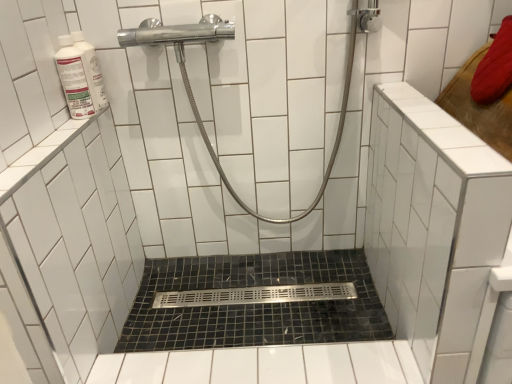
What is the approximate height of black mosaic tile bath at center?

It is 7.89 centimeters.

I want to click on polished chrome showerhead at upper center, so click(230, 38).

How different are the orientations of black mosaic tile bath at center and polished chrome showerhead at upper center in degrees?

There is a 0.8-degree angle between the facing directions of black mosaic tile bath at center and polished chrome showerhead at upper center.

Is black mosaic tile bath at center spatially inside polished chrome showerhead at upper center, or outside of it?

black mosaic tile bath at center is outside polished chrome showerhead at upper center.

Between black mosaic tile bath at center and polished chrome showerhead at upper center, which one has smaller width?

polished chrome showerhead at upper center is thinner.

Where is `shower positioned vertically above the black mosaic tile bath at center (from a real-world perspective)`? The height and width of the screenshot is (384, 512). shower positioned vertically above the black mosaic tile bath at center (from a real-world perspective) is located at coordinates (230, 38).

Locate an element on the screen. shower that is in front of the white glossy bottle at upper left is located at coordinates (230, 38).

Is polished chrome showerhead at upper center spatially inside white glossy bottle at upper left, or outside of it?

polished chrome showerhead at upper center is not enclosed by white glossy bottle at upper left.

Can you confirm if polished chrome showerhead at upper center is positioned to the left of white glossy bottle at upper left?

Incorrect, polished chrome showerhead at upper center is not on the left side of white glossy bottle at upper left.

Who is bigger, polished chrome showerhead at upper center or white glossy bottle at upper left?

With larger size is polished chrome showerhead at upper center.

Are polished chrome showerhead at upper center and black mosaic tile bath at center located far from each other?

polished chrome showerhead at upper center is actually quite close to black mosaic tile bath at center.

Is polished chrome showerhead at upper center oriented away from black mosaic tile bath at center?

polished chrome showerhead at upper center is not turned away from black mosaic tile bath at center.

Is polished chrome showerhead at upper center positioned beyond the bounds of black mosaic tile bath at center?

polished chrome showerhead at upper center is positioned outside black mosaic tile bath at center.

In terms of height, does white glossy bottle at upper left look taller or shorter compared to black mosaic tile bath at center?

white glossy bottle at upper left is taller than black mosaic tile bath at center.

From the image's perspective, is white glossy bottle at upper left on black mosaic tile bath at center?

Yes, from the image's perspective, white glossy bottle at upper left is on top of black mosaic tile bath at center.

Identify the location of toiletry above the black mosaic tile bath at center (from a real-world perspective). (75, 79).

Which of these two, white glossy bottle at upper left or black mosaic tile bath at center, is thinner?

white glossy bottle at upper left is thinner.

From a real-world perspective, is black mosaic tile bath at center positioned above or below white glossy bottle at upper left?

In terms of real-world spatial position, black mosaic tile bath at center is below white glossy bottle at upper left.

Does point (145, 293) lie behind point (84, 82)?

Yes, point (145, 293) is farther from viewer.

There is a black mosaic tile bath at center. At what (x,y) coordinates should I click in order to perform the action: click on toiletry above it (from a real-world perspective). Please return your answer as a coordinate pair (x, y). Image resolution: width=512 pixels, height=384 pixels. Looking at the image, I should click on (75, 79).

Is black mosaic tile bath at center thinner than white glossy bottle at upper left?

No, black mosaic tile bath at center is not thinner than white glossy bottle at upper left.

Which is behind, point (83, 97) or point (180, 52)?

The point (180, 52) is more distant.

Is white glossy bottle at upper left to the left of polished chrome showerhead at upper center from the viewer's perspective?

Indeed, white glossy bottle at upper left is positioned on the left side of polished chrome showerhead at upper center.

Could you tell me if white glossy bottle at upper left is facing polished chrome showerhead at upper center?

Yes, white glossy bottle at upper left faces towards polished chrome showerhead at upper center.

I want to click on bath below the polished chrome showerhead at upper center (from the image's perspective), so click(x=253, y=304).

Locate an element on the screen. toiletry lying above the polished chrome showerhead at upper center (from the image's perspective) is located at coordinates (75, 79).

Estimate the real-world distances between objects in this image. Which object is closer to polished chrome showerhead at upper center, white glossy bottle at upper left or black mosaic tile bath at center?

The object closer to polished chrome showerhead at upper center is white glossy bottle at upper left.

Considering their positions, is black mosaic tile bath at center positioned closer to polished chrome showerhead at upper center than white glossy bottle at upper left?

Based on the image, white glossy bottle at upper left appears to be nearer to polished chrome showerhead at upper center.

Looking at the image, which one is located closer to white glossy bottle at upper left, polished chrome showerhead at upper center or black mosaic tile bath at center?

polished chrome showerhead at upper center is closer to white glossy bottle at upper left.

Looking at the image, which one is located closer to white glossy bottle at upper left, black mosaic tile bath at center or polished chrome showerhead at upper center?

Based on the image, polished chrome showerhead at upper center appears to be nearer to white glossy bottle at upper left.

Looking at the image, which one is located further to black mosaic tile bath at center, white glossy bottle at upper left or polished chrome showerhead at upper center?

Among the two, white glossy bottle at upper left is located further to black mosaic tile bath at center.

Considering their positions, is polished chrome showerhead at upper center positioned further to black mosaic tile bath at center than white glossy bottle at upper left?

white glossy bottle at upper left is positioned further to the anchor black mosaic tile bath at center.

Image resolution: width=512 pixels, height=384 pixels. What are the coordinates of `shower between white glossy bottle at upper left and black mosaic tile bath at center in the up-down direction` in the screenshot? It's located at (230, 38).